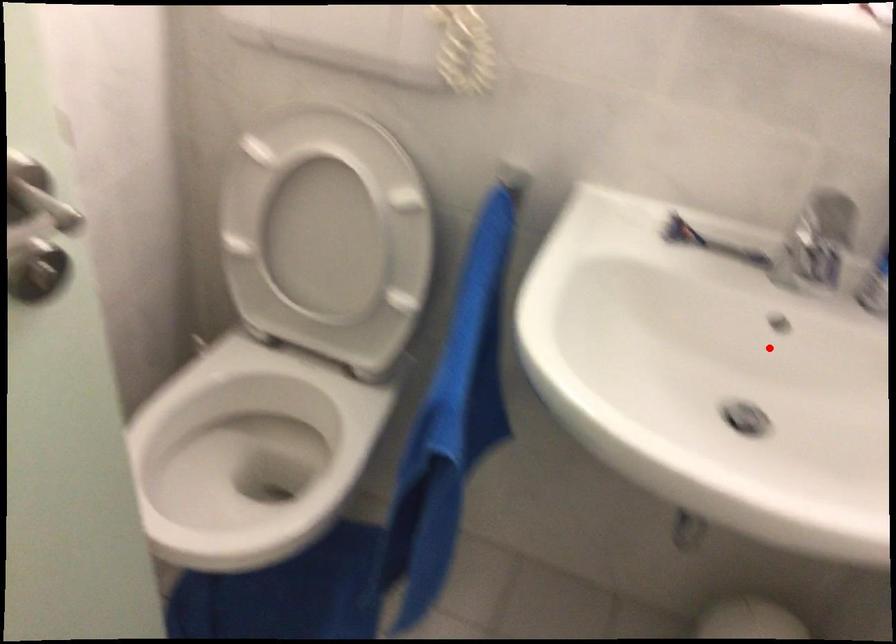
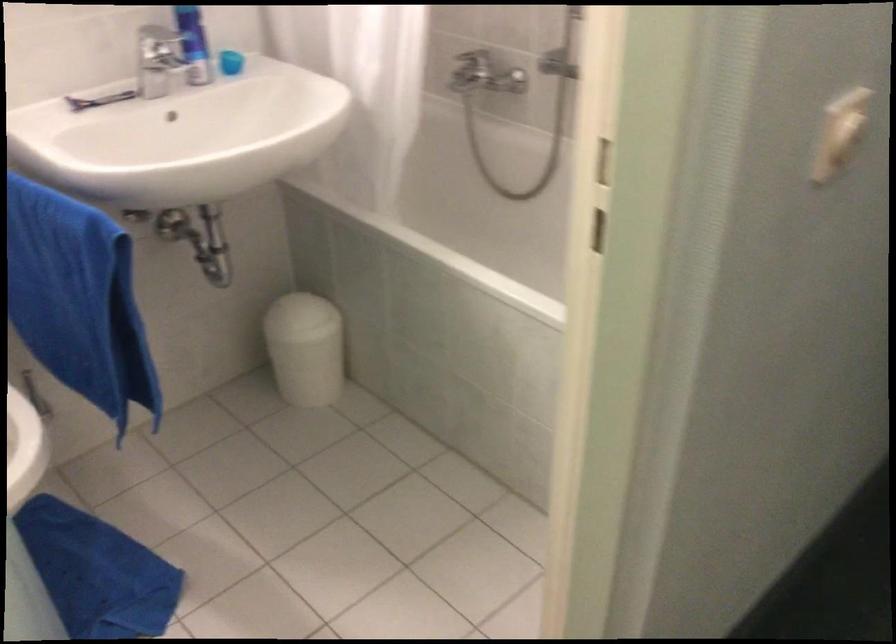
Question: A red point is marked in image1. In image2, is the corresponding 3D point closer to the camera or farther? Reply with the corresponding letter.

Choices:
 (A) The corresponding 3D point is closer.
 (B) The corresponding 3D point is farther.

Answer: (B)